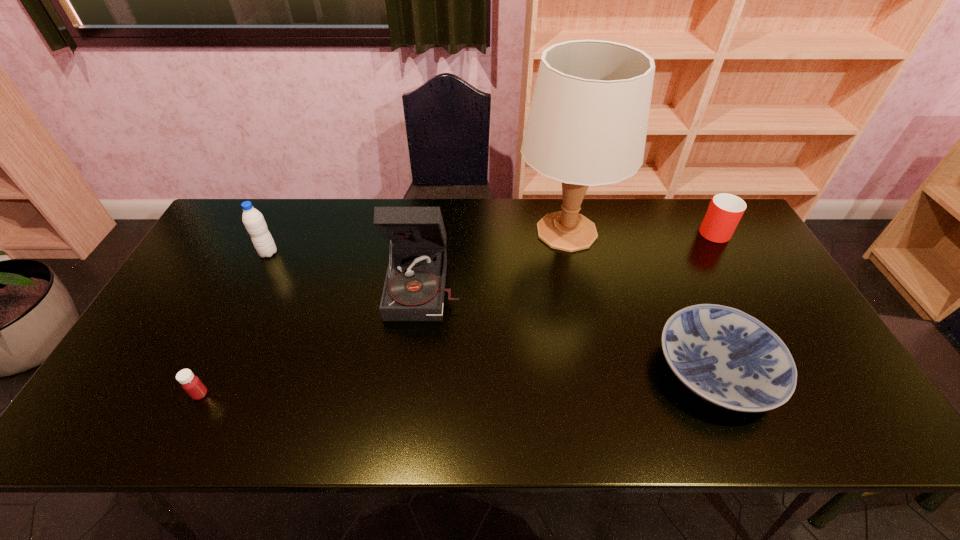
Where is `vacant space located 0.270m on the right of the medicine`? The height and width of the screenshot is (540, 960). vacant space located 0.270m on the right of the medicine is located at coordinates (324, 394).

In order to click on vacant area situated on the left of the plate in this screenshot , I will do `click(631, 370)`.

Where is `table lamp positioned at the far edge`? Image resolution: width=960 pixels, height=540 pixels. table lamp positioned at the far edge is located at coordinates (587, 125).

Identify the location of cup that is positioned at the far edge. The height and width of the screenshot is (540, 960). (724, 212).

This screenshot has height=540, width=960. In order to click on object that is at the near edge in this screenshot , I will do point(727,357).

I want to click on cup located in the right edge section of the desktop, so click(724, 212).

Locate an element on the screen. This screenshot has width=960, height=540. plate situated at the right edge is located at coordinates (727, 357).

Identify the location of object situated at the far right corner. This screenshot has height=540, width=960. (724, 212).

Where is `object that is at the near right corner`? The width and height of the screenshot is (960, 540). object that is at the near right corner is located at coordinates (727, 357).

Identify the location of free space at the far edge of the desktop. Image resolution: width=960 pixels, height=540 pixels. (365, 226).